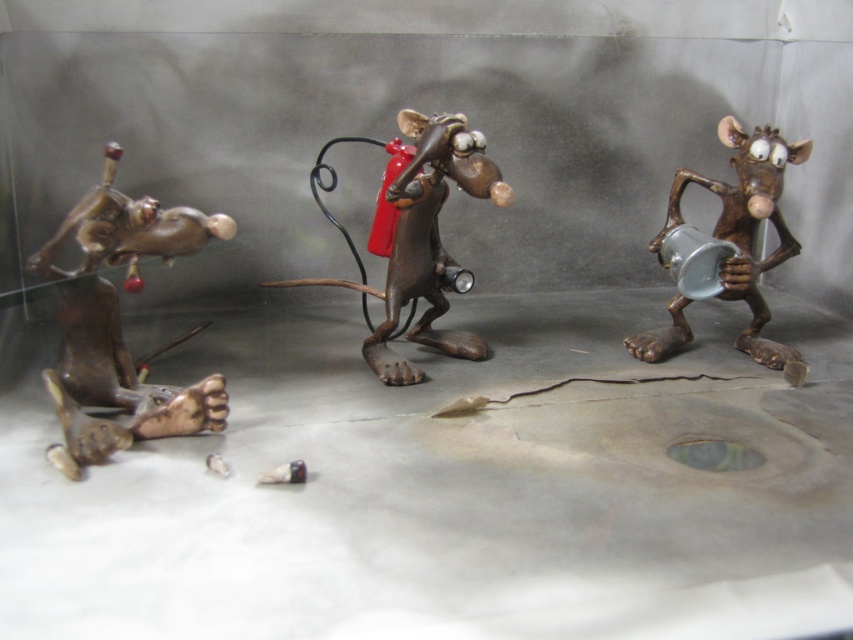
Question: Which object appears closest to the camera in this image?

Choices:
 (A) bronze/metallic mouse at center
 (B) bronze statue at left

Answer: (B)

Question: Which of the following is the closest to the observer?

Choices:
 (A) bronze statue at left
 (B) bronze/metallic mouse at center
 (C) bronze figurine at right

Answer: (A)

Question: Estimate the real-world distances between objects in this image. Which object is closer to the bronze statue at left?

Choices:
 (A) bronze figurine at right
 (B) bronze/metallic mouse at center

Answer: (B)

Question: Is bronze statue at left below bronze/metallic mouse at center?

Choices:
 (A) yes
 (B) no

Answer: (A)

Question: Can you confirm if bronze statue at left is smaller than bronze/metallic mouse at center?

Choices:
 (A) no
 (B) yes

Answer: (B)

Question: Does bronze statue at left come behind bronze figurine at right?

Choices:
 (A) no
 (B) yes

Answer: (A)